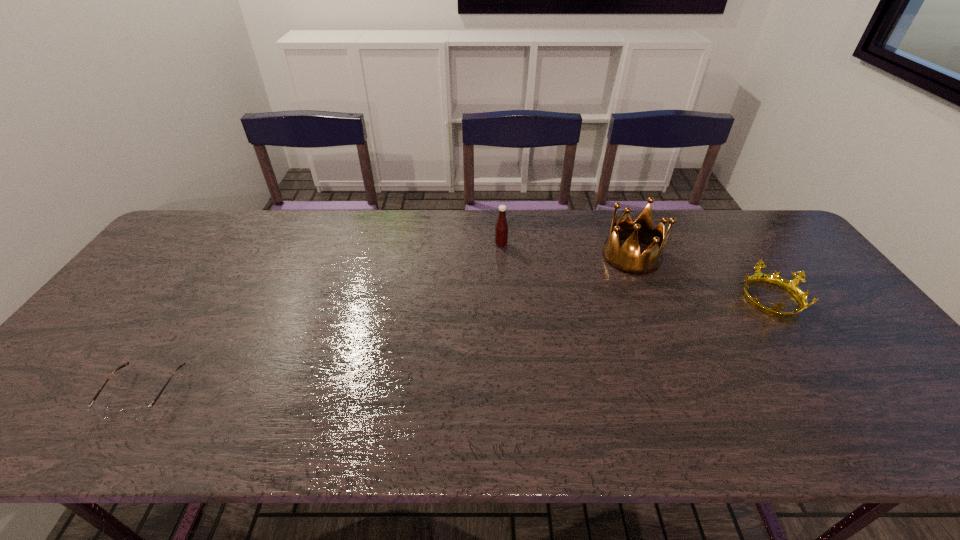
Find the location of a particular element. free space between the Tabasco sauce and the shortest object is located at coordinates (323, 319).

Identify the location of vacant point located between the nearer crown and the left crown. (701, 277).

Locate an element on the screen. empty space that is in between the leftmost object and the Tabasco sauce is located at coordinates (323, 319).

I want to click on empty location between the second shortest object and the tallest object, so click(x=701, y=277).

The height and width of the screenshot is (540, 960). I want to click on vacant area between the third tallest object and the farther crown, so click(x=701, y=277).

This screenshot has height=540, width=960. I want to click on empty space between the second nearest object and the left crown, so click(701, 277).

Find the location of a particular element. blank region between the right crown and the spectacles is located at coordinates (457, 346).

Find the location of a particular element. The width and height of the screenshot is (960, 540). free space between the third tallest object and the taller crown is located at coordinates (701, 277).

You are a GUI agent. You are given a task and a screenshot of the screen. Output one action in this format:
    pyautogui.click(x=<x>, y=<y>)
    Task: Click on the free spot between the leftmost object and the nearer crown
    
    Given the screenshot: What is the action you would take?
    pyautogui.click(x=457, y=346)

In order to click on object that is the nearest to the second object from left to right in this screenshot , I will do `click(627, 259)`.